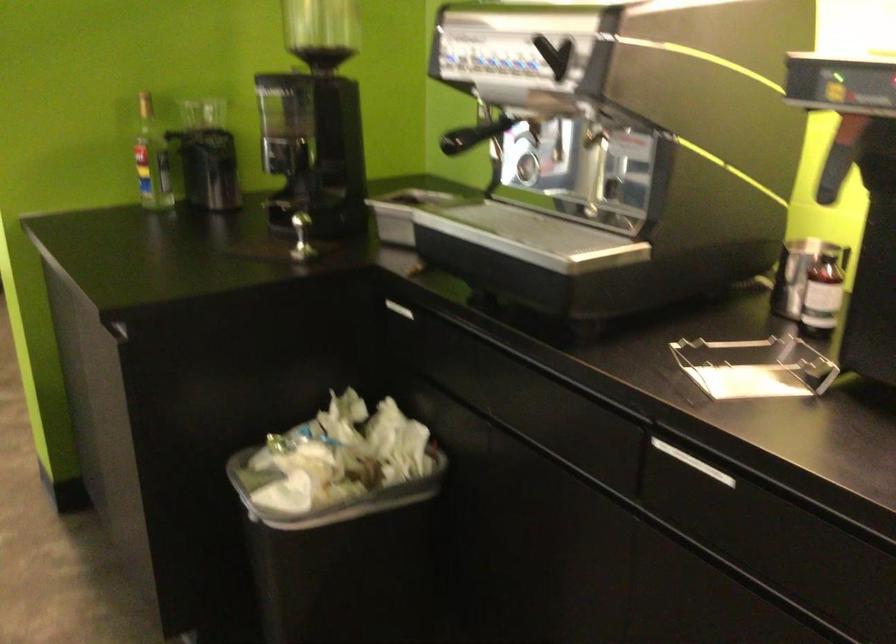
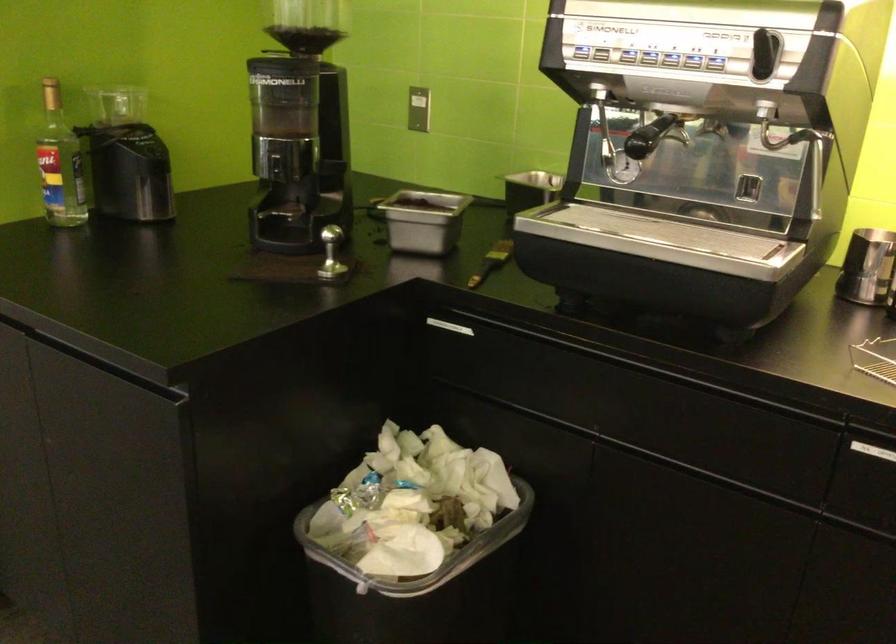
What movement of the cameraman would produce the second image?

The cameraman walked toward left, forward.